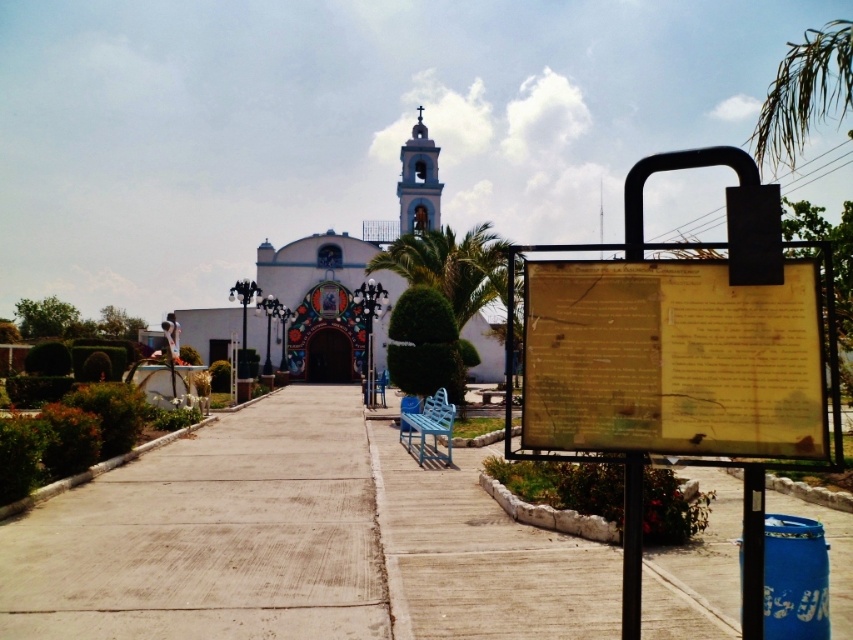
Question: Does gray concrete pavement at center have a lesser width compared to white matte church at center?

Choices:
 (A) yes
 (B) no

Answer: (A)

Question: Which is farther from the yellow paper sign at center?

Choices:
 (A) white matte church at center
 (B) gray concrete pavement at center
 (C) concrete at center

Answer: (A)

Question: Which object appears farthest from the camera in this image?

Choices:
 (A) concrete at center
 (B) gray concrete pavement at center
 (C) white matte church at center

Answer: (C)

Question: Which object is the closest to the gray concrete pavement at center?

Choices:
 (A) white matte church at center
 (B) concrete at center

Answer: (B)

Question: Observing the image, what is the correct spatial positioning of gray concrete pavement at center in reference to white matte church at center?

Choices:
 (A) above
 (B) below

Answer: (B)

Question: From the image, what is the correct spatial relationship of yellow paper sign at center in relation to white matte church at center?

Choices:
 (A) right
 (B) left

Answer: (A)